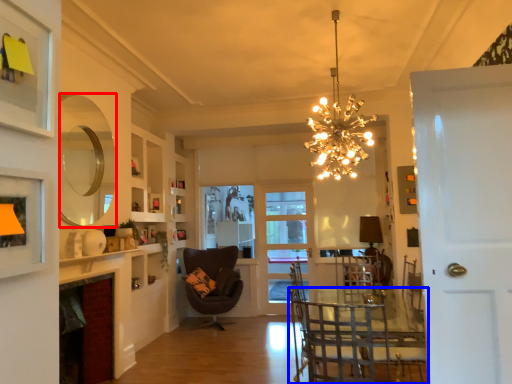
Question: Which of the following is the closest to the observer, mirror (highlighted by a red box) or chair (highlighted by a blue box)?

Choices:
 (A) mirror
 (B) chair

Answer: (B)